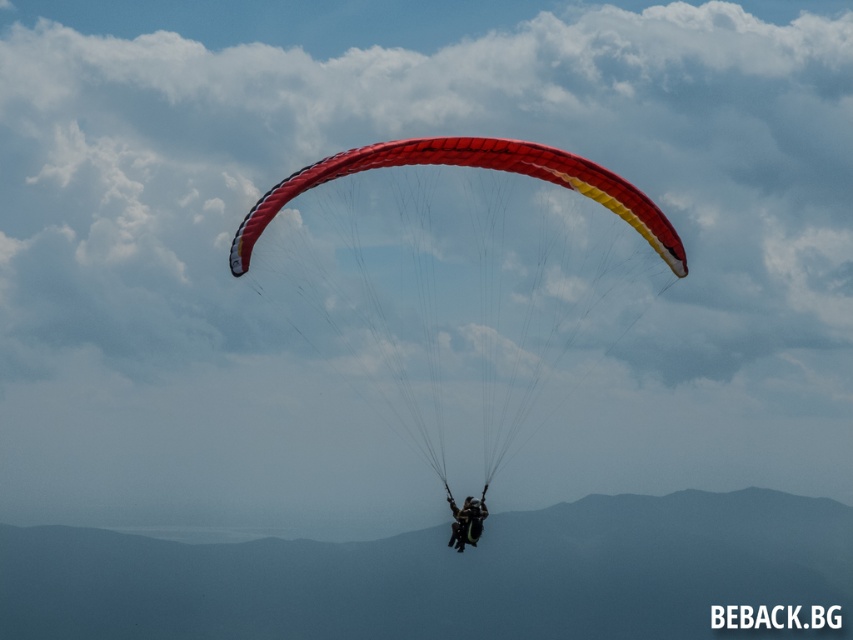
Question: Among these points, which one is nearest to the camera?

Choices:
 (A) (461, 515)
 (B) (548, 157)

Answer: (B)

Question: Which point is closer to the camera taking this photo?

Choices:
 (A) (641, 218)
 (B) (467, 499)

Answer: (A)

Question: Observing the image, what is the correct spatial positioning of red fabric parachute at center in reference to black fabric parachute at center?

Choices:
 (A) above
 (B) below

Answer: (A)

Question: Can you confirm if red fabric parachute at center is wider than black fabric parachute at center?

Choices:
 (A) yes
 (B) no

Answer: (A)

Question: Does red fabric parachute at center have a smaller size compared to black fabric parachute at center?

Choices:
 (A) yes
 (B) no

Answer: (B)

Question: Which point is closer to the camera?

Choices:
 (A) black fabric parachute at center
 (B) red fabric parachute at center

Answer: (B)